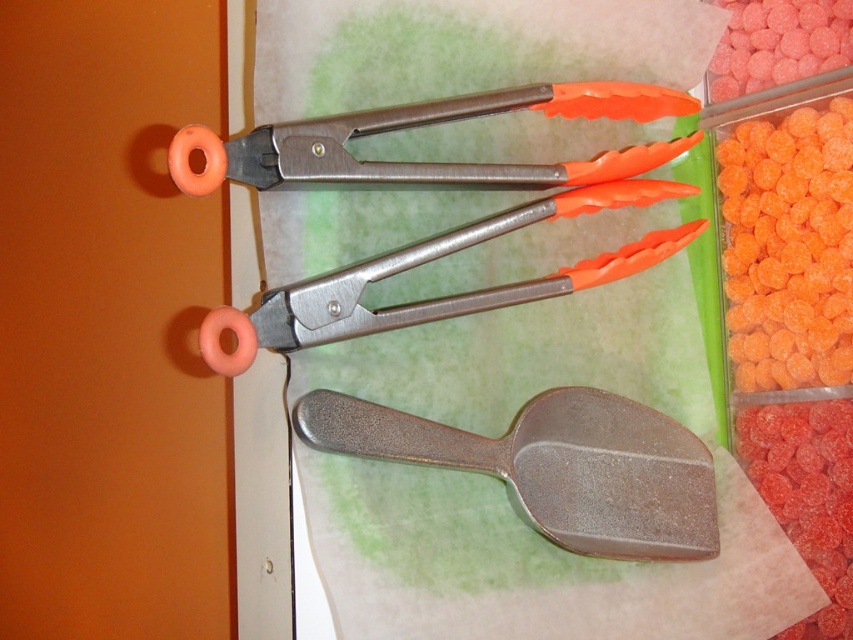
Based on the photo, is metallic gray spatula at center shorter than orange matte gumballs at upper right?

No.

Is metallic gray spatula at center to the right of orange matte gumballs at upper right from the viewer's perspective?

No, metallic gray spatula at center is not to the right of orange matte gumballs at upper right.

Locate an element on the screen. The width and height of the screenshot is (853, 640). metallic gray spatula at center is located at coordinates (554, 467).

Which is more to the left, orange rubber tongs at upper center or orange matte gumballs at upper right?

Positioned to the left is orange rubber tongs at upper center.

What do you see at coordinates (428, 124) in the screenshot?
I see `orange rubber tongs at upper center` at bounding box center [428, 124].

Find the location of a particular element. This screenshot has height=640, width=853. orange rubber tongs at upper center is located at coordinates (428, 124).

Between point (569, 458) and point (310, 337), which one is positioned behind?

The point (569, 458) is more distant.

Can you confirm if metallic gray spatula at center is positioned to the left of orange plastic tongs at upper center?

In fact, metallic gray spatula at center is to the right of orange plastic tongs at upper center.

Locate an element on the screen. The height and width of the screenshot is (640, 853). metallic gray spatula at center is located at coordinates (554, 467).